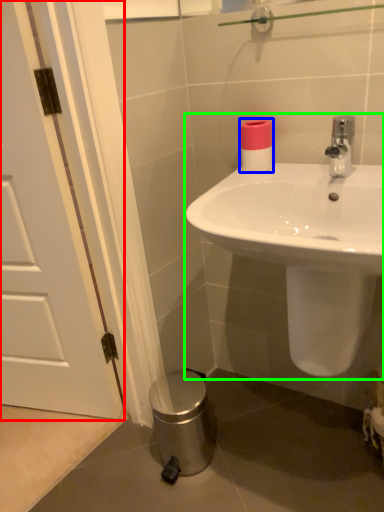
Question: Considering the real-world distances, which object is farthest from door (highlighted by a red box)? toilet paper (highlighted by a blue box) or sink (highlighted by a green box)?

Choices:
 (A) toilet paper
 (B) sink

Answer: (A)